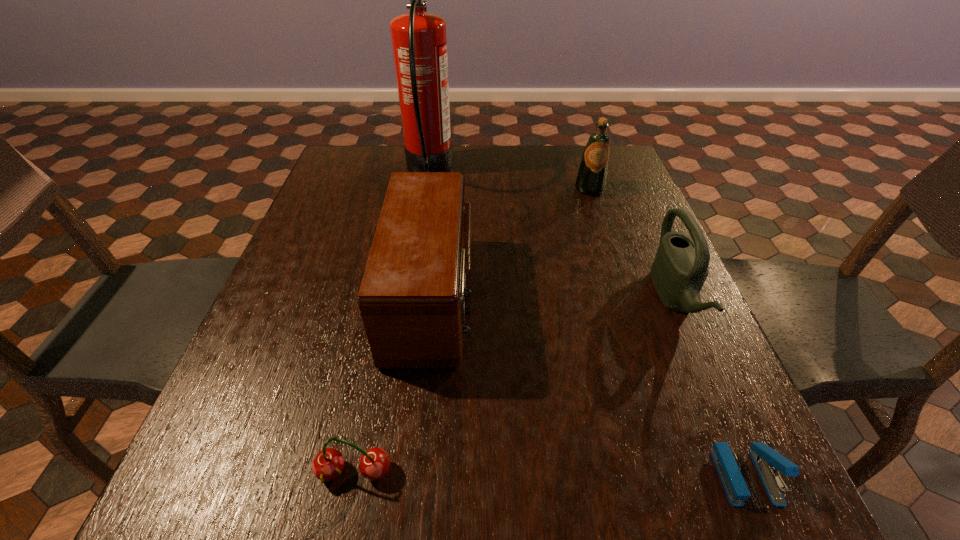
This screenshot has height=540, width=960. I want to click on fire extinguisher, so click(419, 39).

You are a GUI agent. You are given a task and a screenshot of the screen. Output one action in this format:
    pyautogui.click(x=<x>, y=<y>)
    Task: Click on the olive oil
    Image resolution: width=960 pixels, height=540 pixels.
    Given the screenshot: What is the action you would take?
    pyautogui.click(x=591, y=179)

I want to click on radio receiver, so click(412, 297).

This screenshot has height=540, width=960. I want to click on watering can, so click(680, 267).

Locate an element on the screen. The height and width of the screenshot is (540, 960). cherry is located at coordinates (328, 464).

Find the location of `the shortest object`. the shortest object is located at coordinates (767, 461).

Identify the location of vacant point located 0.210m on the front-facing side of the tallest object. Image resolution: width=960 pixels, height=540 pixels. (523, 170).

I want to click on vacant point located on the front-facing side of the third object from right to left, so click(x=627, y=305).

This screenshot has width=960, height=540. Find the location of `free location located 0.300m on the front-facing side of the radio receiver`. free location located 0.300m on the front-facing side of the radio receiver is located at coordinates (612, 296).

Locate an element on the screen. The image size is (960, 540). vacant region located on the spout of the watering can is located at coordinates (620, 299).